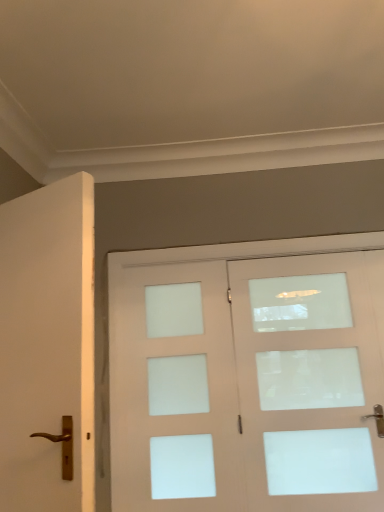
Question: In terms of width, does white matte door at left, arranged as the first door when viewed from the left, look wider or thinner when compared to white frosted glass screen door at center?

Choices:
 (A) thin
 (B) wide

Answer: (B)

Question: Is white matte door at left, acting as the first door starting from the front, inside or outside of white frosted glass screen door at center?

Choices:
 (A) outside
 (B) inside

Answer: (A)

Question: Considering the real-world distances, which object is closest to the white frosted glass screen door at center?

Choices:
 (A) white matte door at left, which is the second door in right-to-left order
 (B) matte white door at center, acting as the first door starting from the back

Answer: (B)

Question: Considering the real-world distances, which object is closest to the white matte door at left, acting as the first door starting from the front?

Choices:
 (A) matte white door at center, which is counted as the 1th door, starting from the right
 (B) white frosted glass screen door at center

Answer: (B)